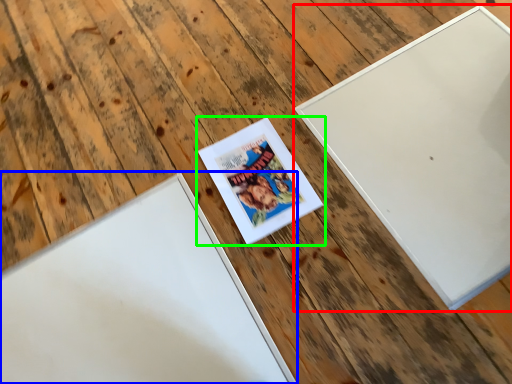
Question: Which object is positioned farthest from picture frame (highlighted by a red box)? Select from picture frame (highlighted by a blue box) and picture frame (highlighted by a green box).

Choices:
 (A) picture frame
 (B) picture frame

Answer: (A)